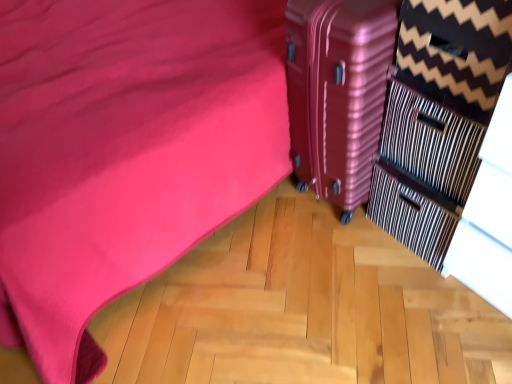
Question: Relative to metallic pink suitcase at right, is striped fabric dresser at right in front or behind?

Choices:
 (A) front
 (B) behind

Answer: (A)

Question: From their relative heights in the image, would you say striped fabric dresser at right is taller or shorter than metallic pink suitcase at right?

Choices:
 (A) tall
 (B) short

Answer: (B)

Question: Which is correct: striped fabric dresser at right is inside metallic pink suitcase at right, or outside of it?

Choices:
 (A) inside
 (B) outside

Answer: (B)

Question: From a real-world perspective, is metallic pink suitcase at right above or below striped fabric dresser at right?

Choices:
 (A) below
 (B) above

Answer: (A)

Question: Does point (377, 66) appear closer or farther from the camera than point (509, 8)?

Choices:
 (A) farther
 (B) closer

Answer: (A)

Question: Considering the positions of metallic pink suitcase at right and striped fabric dresser at right in the image, is metallic pink suitcase at right taller or shorter than striped fabric dresser at right?

Choices:
 (A) short
 (B) tall

Answer: (B)

Question: In the image, is metallic pink suitcase at right on the left side or the right side of striped fabric dresser at right?

Choices:
 (A) left
 (B) right

Answer: (A)